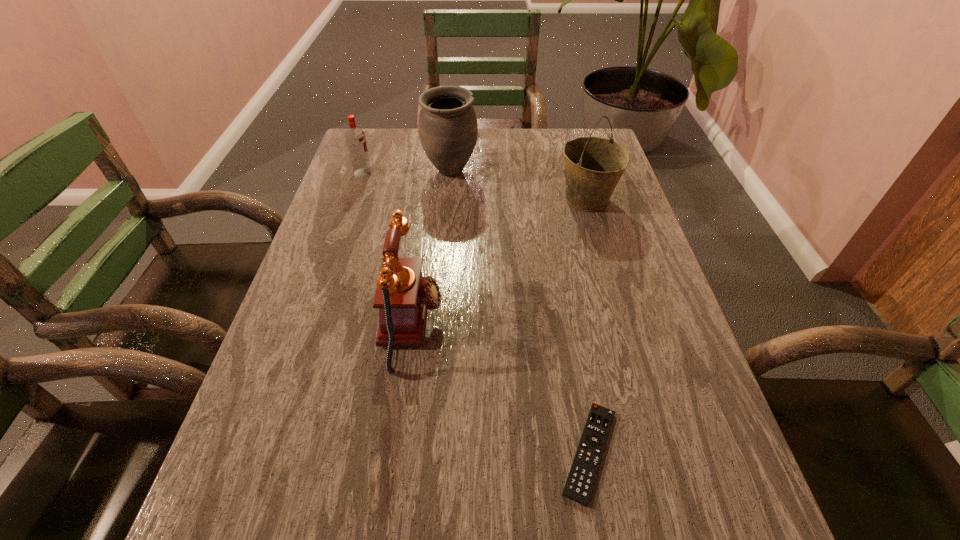
Find the location of a particular element. The height and width of the screenshot is (540, 960). free location that satisfies the following two spatial constraints: 1. on the front side of the wine bucket; 2. on the dial of the telephone is located at coordinates (622, 325).

The height and width of the screenshot is (540, 960). In order to click on free space that satisfies the following two spatial constraints: 1. on the dial of the telephone; 2. on the back side of the nearest object in this screenshot , I will do `click(395, 452)`.

The height and width of the screenshot is (540, 960). Find the location of `vacant space that satisfies the following two spatial constraints: 1. on the dial of the remote control; 2. on the left side of the telephone`. vacant space that satisfies the following two spatial constraints: 1. on the dial of the remote control; 2. on the left side of the telephone is located at coordinates (395, 452).

Find the location of `vacant space that satisfies the following two spatial constraints: 1. on the front label of the remote control; 2. on the left side of the leftmost object`. vacant space that satisfies the following two spatial constraints: 1. on the front label of the remote control; 2. on the left side of the leftmost object is located at coordinates (271, 452).